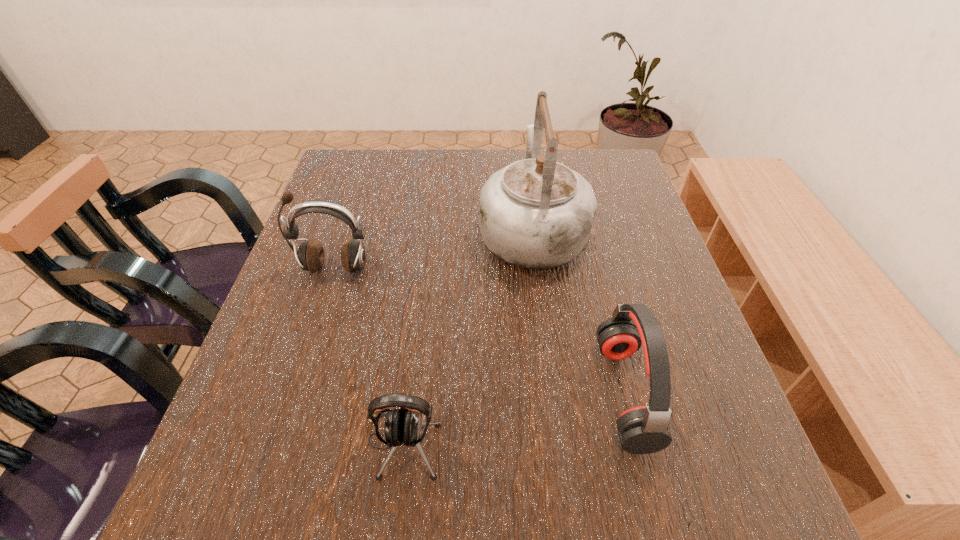
Find the location of `vacant region that satisfies the following two spatial constraints: 1. on the ear cups of the rightmost earphone; 2. on the front side of the second earphone from left to right`. vacant region that satisfies the following two spatial constraints: 1. on the ear cups of the rightmost earphone; 2. on the front side of the second earphone from left to right is located at coordinates (637, 443).

Where is `free location that satisfies the following two spatial constraints: 1. on the ear cups of the rightmost earphone; 2. on the front side of the third object from right to left`? This screenshot has width=960, height=540. free location that satisfies the following two spatial constraints: 1. on the ear cups of the rightmost earphone; 2. on the front side of the third object from right to left is located at coordinates (637, 443).

You are a GUI agent. You are given a task and a screenshot of the screen. Output one action in this format:
    pyautogui.click(x=<x>, y=<y>)
    Task: Click on the free space that satisfies the following two spatial constraints: 1. on the ear pads of the leftmost earphone; 2. on the right side of the second earphone from right to left
    The width and height of the screenshot is (960, 540).
    Given the screenshot: What is the action you would take?
    pyautogui.click(x=277, y=443)